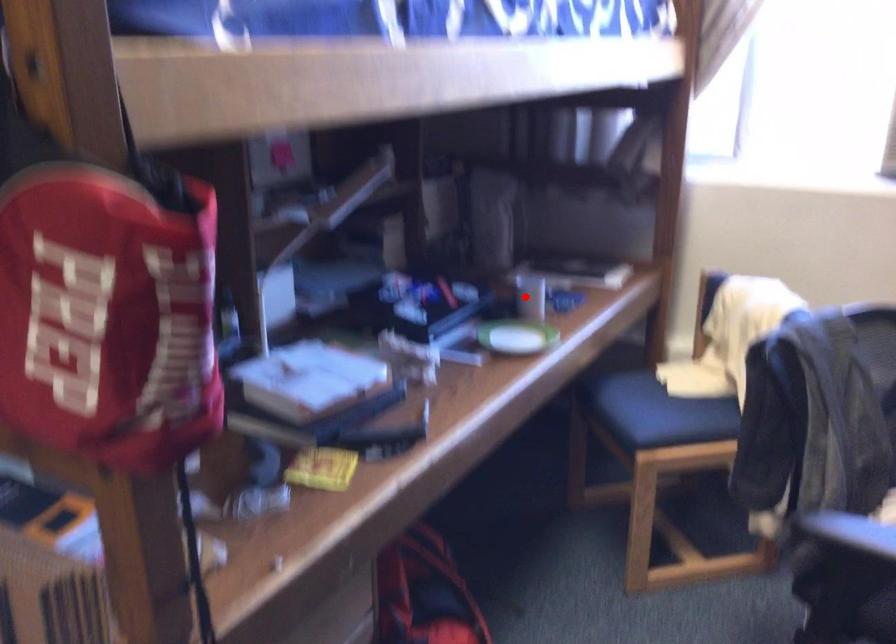
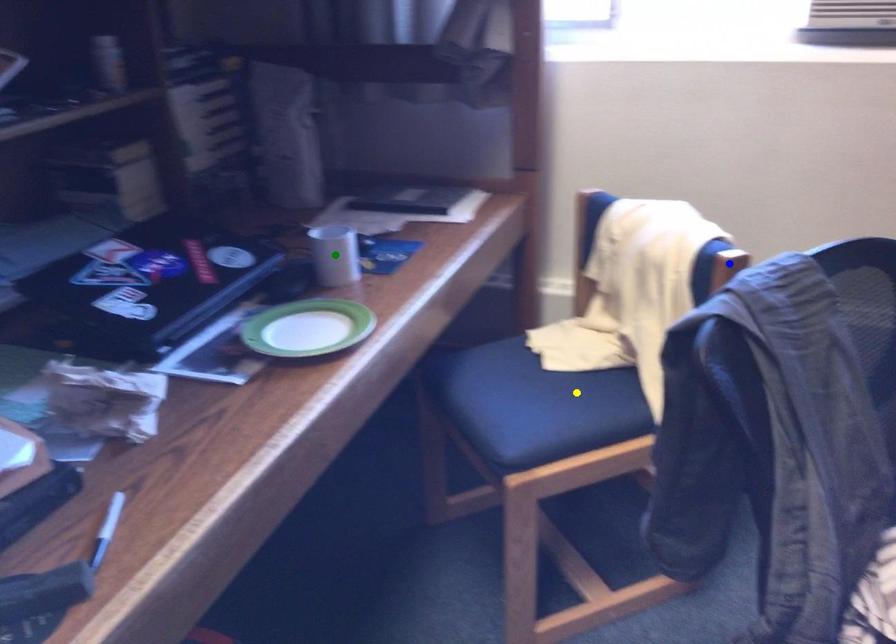
Question: I am providing you with two images of the same scene from different viewpoints. A red point is marked on the first image. You are given multiple points on the second image. Can you choose the point in image 2 that corresponds to the point in image 1?

Choices:
 (A) blue point
 (B) green point
 (C) yellow point

Answer: (B)